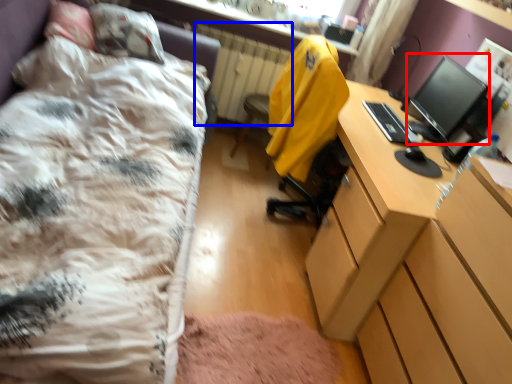
Question: Which object appears farthest to the camera in this image, computer monitor (highlighted by a red box) or radiator (highlighted by a blue box)?

Choices:
 (A) computer monitor
 (B) radiator

Answer: (B)